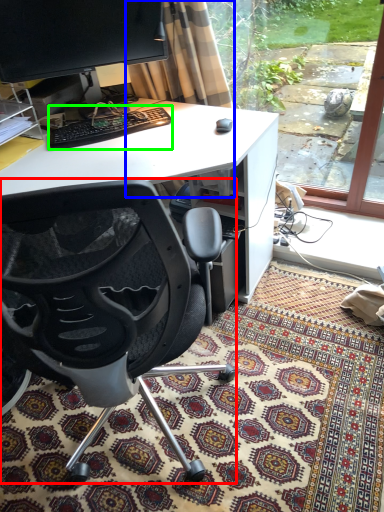
Question: Considering the real-world distances, which object is farthest from chair (highlighted by a red box)? curtain (highlighted by a blue box) or computer keyboard (highlighted by a green box)?

Choices:
 (A) curtain
 (B) computer keyboard

Answer: (A)